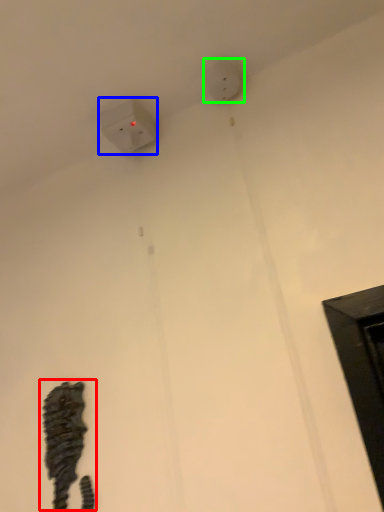
Question: Estimate the real-world distances between objects in this image. Which object is farther from animal (highlighted by a red box), power plugs and sockets (highlighted by a blue box) or electric outlet (highlighted by a green box)?

Choices:
 (A) power plugs and sockets
 (B) electric outlet

Answer: (B)